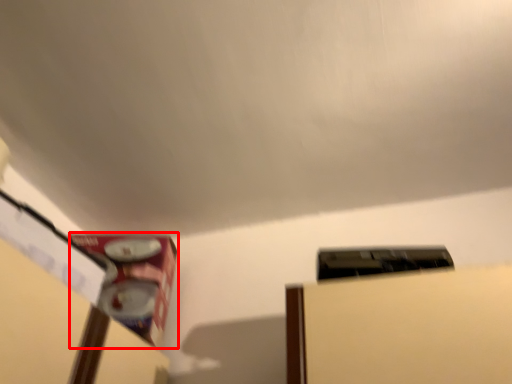
Question: In this image, where is water heater (annotated by the red box) located relative to water heater?

Choices:
 (A) right
 (B) left

Answer: (B)